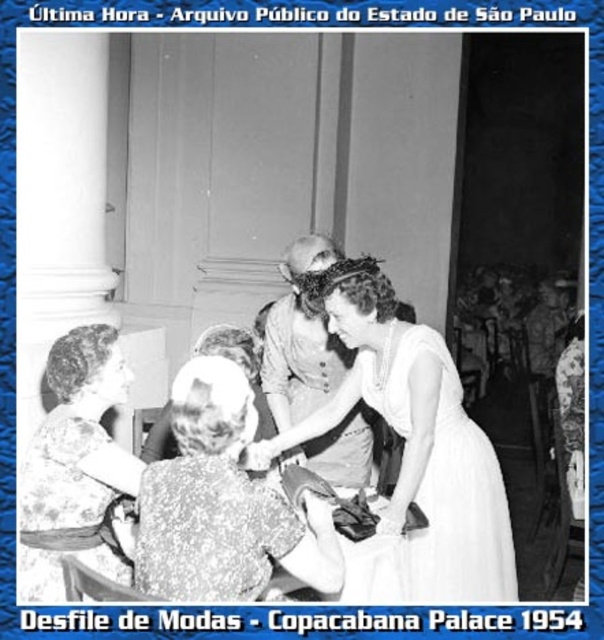
Does white satin dress at center lie in front of smooth fabric dress at center?

Yes, it is.

Consider the image. Who is more forward, (486,545) or (277,310)?

Point (486,545)

Where is `white satin dress at center`? This screenshot has width=604, height=640. white satin dress at center is located at coordinates (414, 444).

Is floral-patterned fabric dress at lower left smaller than smooth white hat at center?

Correct, floral-patterned fabric dress at lower left occupies less space than smooth white hat at center.

Does floral-patterned fabric dress at lower left appear on the left side of smooth white hat at center?

Indeed, floral-patterned fabric dress at lower left is positioned on the left side of smooth white hat at center.

Is point (91, 529) behind point (226, 340)?

No, (91, 529) is closer to viewer.

This screenshot has width=604, height=640. Identify the location of floral-patterned fabric dress at lower left. (76, 467).

Is point (300, 522) farther from viewer compared to point (112, 556)?

No.

Which is more to the left, matte white dress at center or floral-patterned fabric dress at lower left?

floral-patterned fabric dress at lower left

Image resolution: width=604 pixels, height=640 pixels. What do you see at coordinates (222, 502) in the screenshot?
I see `matte white dress at center` at bounding box center [222, 502].

Find the location of a particular element. Image resolution: width=604 pixels, height=640 pixels. matte white dress at center is located at coordinates (222, 502).